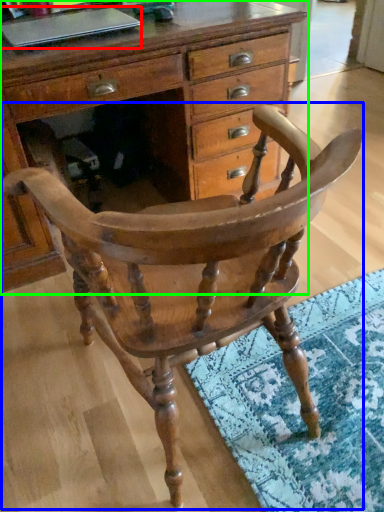
Question: Based on their relative distances, which object is nearer to laptop (highlighted by a red box)? Choose from chair (highlighted by a blue box) and chest of drawers (highlighted by a green box).

Choices:
 (A) chair
 (B) chest of drawers

Answer: (B)